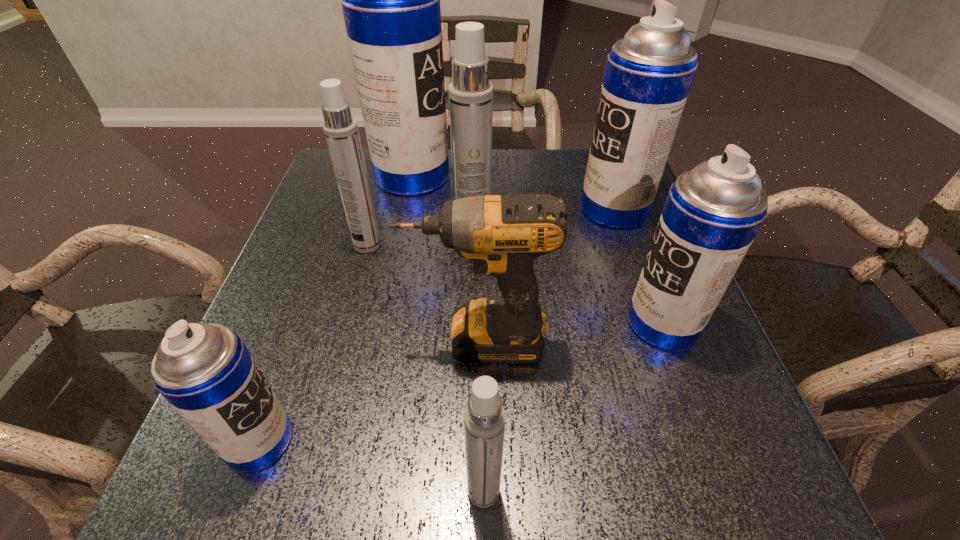
The width and height of the screenshot is (960, 540). I want to click on the second blue aerosol can from left to right, so click(x=390, y=0).

Locate an element on the screen. This screenshot has width=960, height=540. the biggest blue aerosol can is located at coordinates (390, 0).

Identify the location of the third smallest blue aerosol can. (648, 75).

Identify the location of the biggest white aerosol can. click(470, 93).

Identify the location of the second smallest white aerosol can. (341, 132).

Identify the location of the third farthest blue aerosol can. Image resolution: width=960 pixels, height=540 pixels. (713, 212).

Locate an element on the screen. the third nearest aerosol can is located at coordinates (713, 212).

The height and width of the screenshot is (540, 960). I want to click on drill, so click(x=503, y=235).

This screenshot has width=960, height=540. In order to click on the nearest blue aerosol can in this screenshot , I will do click(x=205, y=371).

The height and width of the screenshot is (540, 960). I want to click on the smallest blue aerosol can, so click(205, 371).